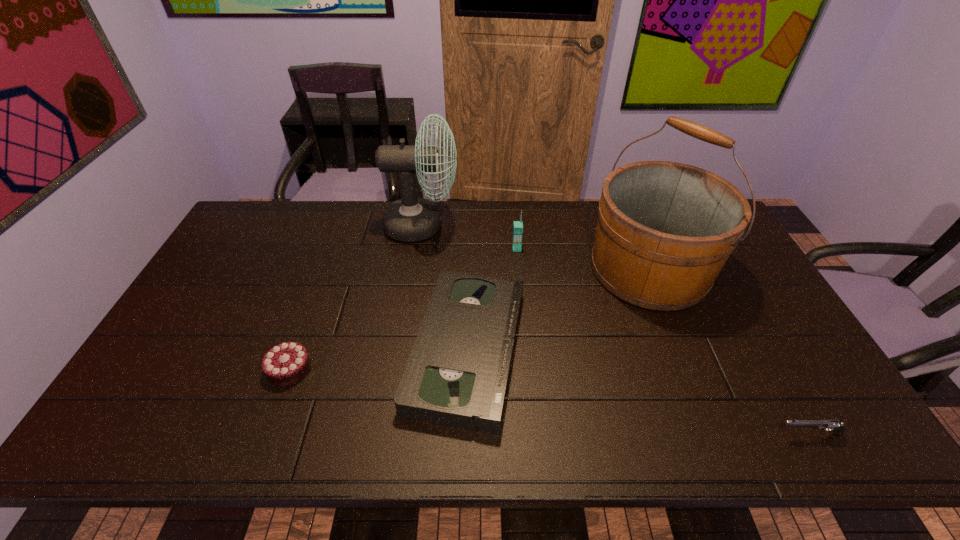
Find the location of a particular element. Image resolution: width=960 pixels, height=540 pixels. object that is at the far right corner is located at coordinates (665, 230).

Locate an element on the screen. The image size is (960, 540). object at the near right corner is located at coordinates (837, 427).

The height and width of the screenshot is (540, 960). In order to click on vacant space at the far edge of the desktop in this screenshot , I will do `click(294, 233)`.

The height and width of the screenshot is (540, 960). I want to click on free space at the near edge of the desktop, so click(x=701, y=427).

The image size is (960, 540). In the image, there is a desktop. Identify the location of vacant region at the left edge. (266, 259).

Where is `vacant space at the right edge of the desktop`? The image size is (960, 540). vacant space at the right edge of the desktop is located at coordinates coord(788,369).

Locate an element on the screen. empty space that is in between the third tallest object and the pistol is located at coordinates (662, 341).

You are a GUI agent. You are given a task and a screenshot of the screen. Output one action in this format:
    pyautogui.click(x=<x>, y=<y>)
    Task: Click on the vacant area that lies between the leftmost object and the cellular telephone
    
    Given the screenshot: What is the action you would take?
    pyautogui.click(x=403, y=309)

In order to click on vacant space that's between the bucket and the videotape in this screenshot , I will do `click(558, 309)`.

Where is `free space between the bucket and the videotape`? The height and width of the screenshot is (540, 960). free space between the bucket and the videotape is located at coordinates (558, 309).